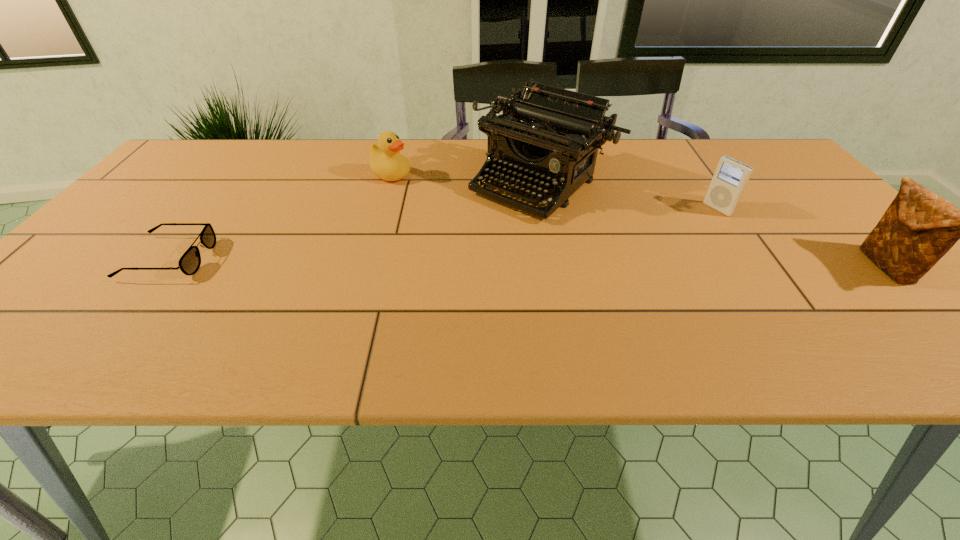
This screenshot has width=960, height=540. Find the location of `free space located 0.100m on the open side of the clutch bag`. free space located 0.100m on the open side of the clutch bag is located at coordinates (823, 267).

Where is `vacant space located 0.230m on the open side of the clutch bag`? The image size is (960, 540). vacant space located 0.230m on the open side of the clutch bag is located at coordinates (762, 267).

Locate an element on the screen. This screenshot has width=960, height=540. free spot located on the front-facing side of the iPod is located at coordinates (660, 242).

Where is `free spot located on the front-facing side of the iPod`? This screenshot has height=540, width=960. free spot located on the front-facing side of the iPod is located at coordinates (614, 267).

Where is `vacant space situated 0.130m on the front-facing side of the iPod`? The height and width of the screenshot is (540, 960). vacant space situated 0.130m on the front-facing side of the iPod is located at coordinates (679, 232).

I want to click on free space located at the beak of the duck, so click(x=429, y=192).

At what (x,y) coordinates should I click in order to perform the action: click on vacant area located at the beak of the duck. Please return your answer as a coordinate pair (x, y). Looking at the image, I should click on (516, 231).

The image size is (960, 540). I want to click on vacant space situated 0.210m at the beak of the duck, so click(x=464, y=208).

At what (x,y) coordinates should I click in order to perform the action: click on vacant area situated on the keyboard of the third object from right to left. Please return your answer as a coordinate pair (x, y). The image size is (960, 540). Looking at the image, I should click on (399, 304).

I want to click on free space located 0.140m on the keyboard of the third object from right to left, so click(x=468, y=245).